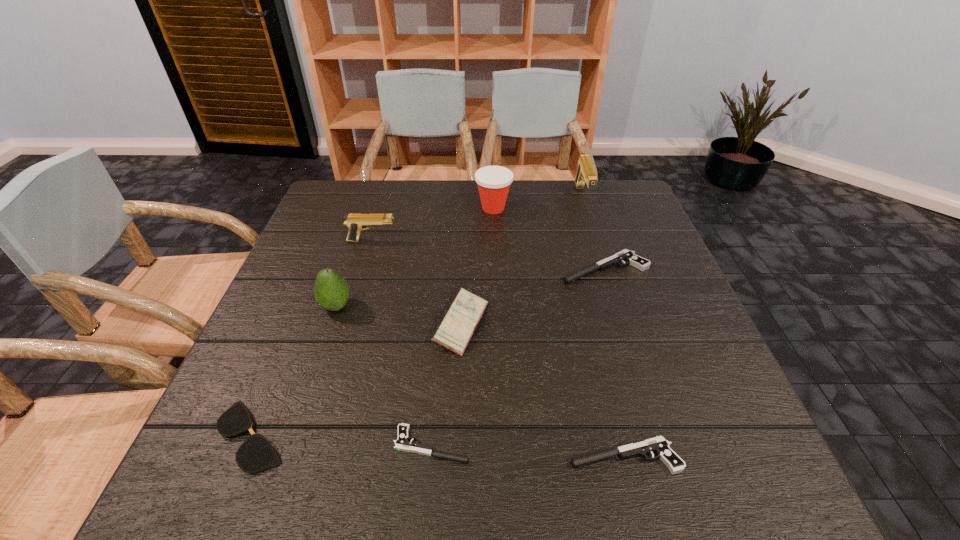
Find the location of a particular element. Dixie cup at the far edge is located at coordinates (493, 182).

At what (x,y) coordinates should I click in order to perform the action: click on spectacles that is at the near edge. Please return your answer as a coordinate pair (x, y). The image size is (960, 540). Looking at the image, I should click on (256, 453).

Locate an element on the screen. Image resolution: width=960 pixels, height=540 pixels. avocado present at the left edge is located at coordinates (331, 291).

This screenshot has height=540, width=960. Identify the location of pistol positioned at the left edge. (355, 222).

Image resolution: width=960 pixels, height=540 pixels. In order to click on spectacles located in the left edge section of the desktop in this screenshot , I will do coord(256,453).

Where is `object located in the near left corner section of the desktop`? The image size is (960, 540). object located in the near left corner section of the desktop is located at coordinates (256, 453).

Find the location of a particular element. This screenshot has width=960, height=540. object positioned at the far right corner is located at coordinates (585, 173).

You are a GUI agent. You are given a task and a screenshot of the screen. Output one action in this format:
    pyautogui.click(x=<x>, y=<y>)
    Task: Click on the object situated at the near right corner
    This screenshot has height=540, width=960.
    Given the screenshot: What is the action you would take?
    pyautogui.click(x=659, y=445)

In the image, there is a desktop. Identify the location of blank space at the far edge. The width and height of the screenshot is (960, 540). pos(455,207).

Where is `free location at the left edge`? The height and width of the screenshot is (540, 960). free location at the left edge is located at coordinates (281, 366).